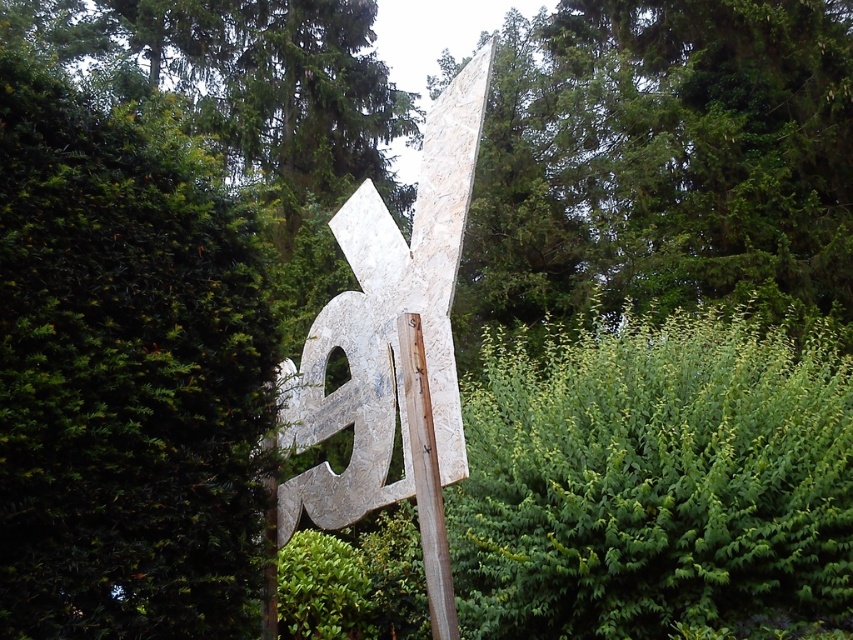
Describe the element at coordinates (387, 326) in the screenshot. This screenshot has height=640, width=853. I see `rusty metal sign at center` at that location.

Which is behind, point (450, 404) or point (416, 401)?

Point (450, 404)

Between point (479, 86) and point (438, 625), which one is positioned in front?

Positioned in front is point (438, 625).

Locate an element on the screen. Image resolution: width=853 pixels, height=640 pixels. rusty metal sign at center is located at coordinates (387, 326).